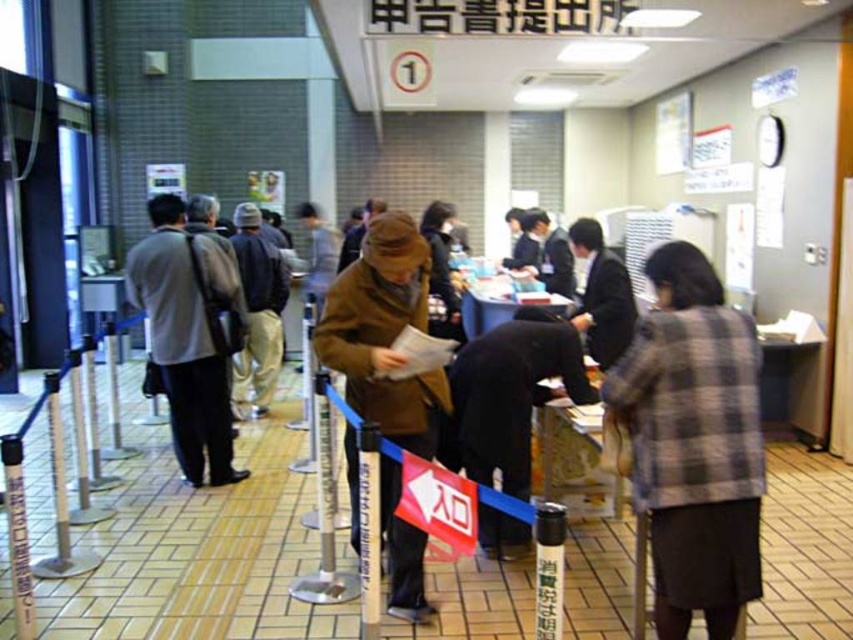
You are standing in the waiting area and notice two coats hanging on a rack between the entrance and the counter. The coats are the plaid fabric jacket at center and the brown woolen coat at center. Which coat reaches a lower point on your body?

The plaid fabric jacket at center is shorter than the brown woolen coat at center, so it reaches a lower point on your body.

You are standing in the waiting area and need to locate both the plaid fabric jacket at center and the brown woolen coat at center. Which one is positioned to the right of the other?

The plaid fabric jacket at center is to the right of the brown woolen coat at center, so the plaid fabric jacket is positioned to the right of the brown woolen coat.